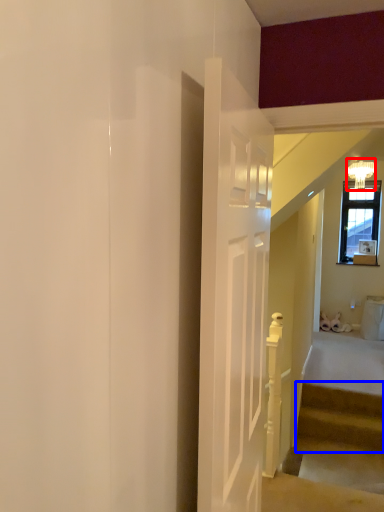
Question: Which of the following is the closest to the observer, light fixture (highlighted by a red box) or stairs (highlighted by a blue box)?

Choices:
 (A) light fixture
 (B) stairs

Answer: (B)